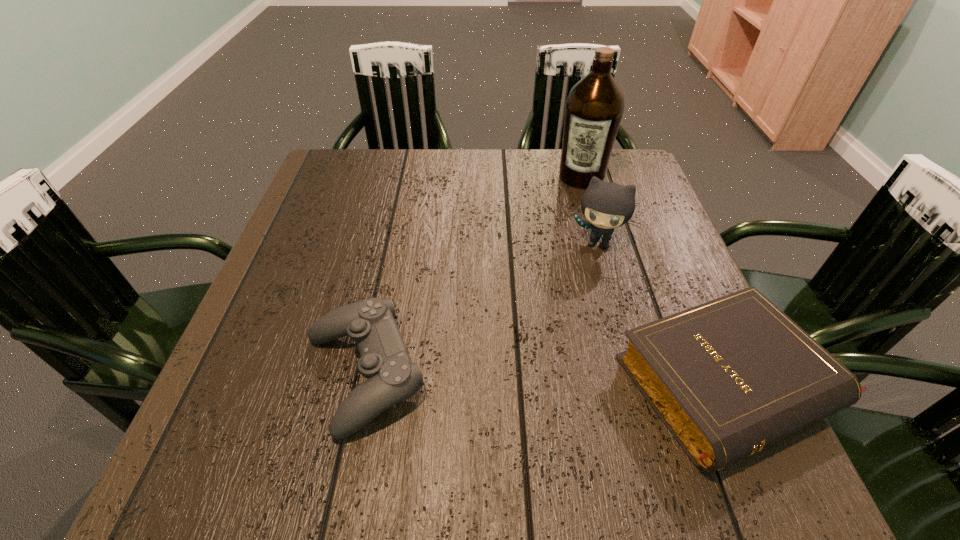
Where is `free region that satisfies the following two spatial constraints: 1. on the back side of the third shortest object; 2. on the left side of the leftmost object`? This screenshot has height=540, width=960. free region that satisfies the following two spatial constraints: 1. on the back side of the third shortest object; 2. on the left side of the leftmost object is located at coordinates [392, 242].

Where is `free spot that satisfies the following two spatial constraints: 1. on the back side of the leftmost object; 2. on the right side of the kitten`? The image size is (960, 540). free spot that satisfies the following two spatial constraints: 1. on the back side of the leftmost object; 2. on the right side of the kitten is located at coordinates (392, 242).

Where is `free point that satisfies the following two spatial constraints: 1. on the front side of the olive oil; 2. on the right side of the Bible`? This screenshot has width=960, height=540. free point that satisfies the following two spatial constraints: 1. on the front side of the olive oil; 2. on the right side of the Bible is located at coordinates (640, 383).